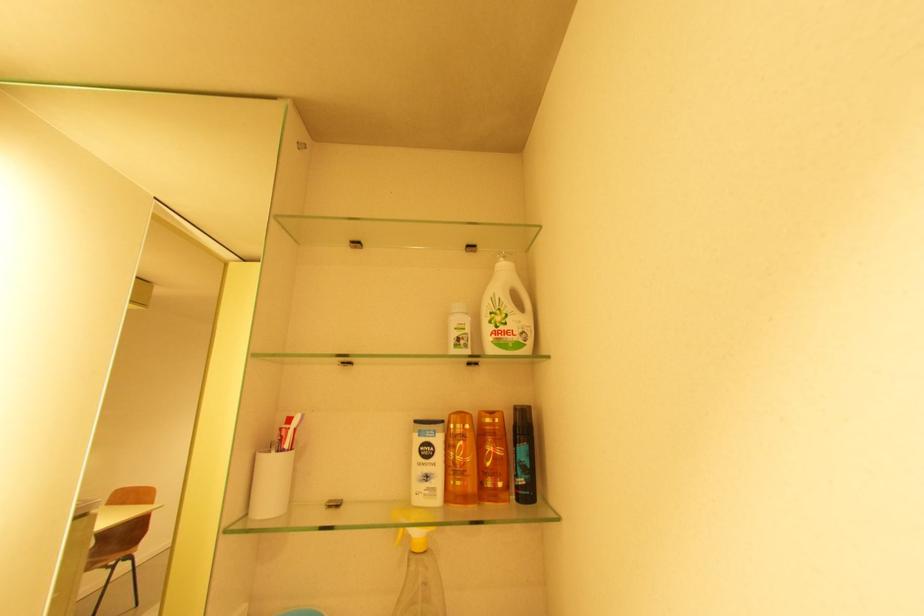
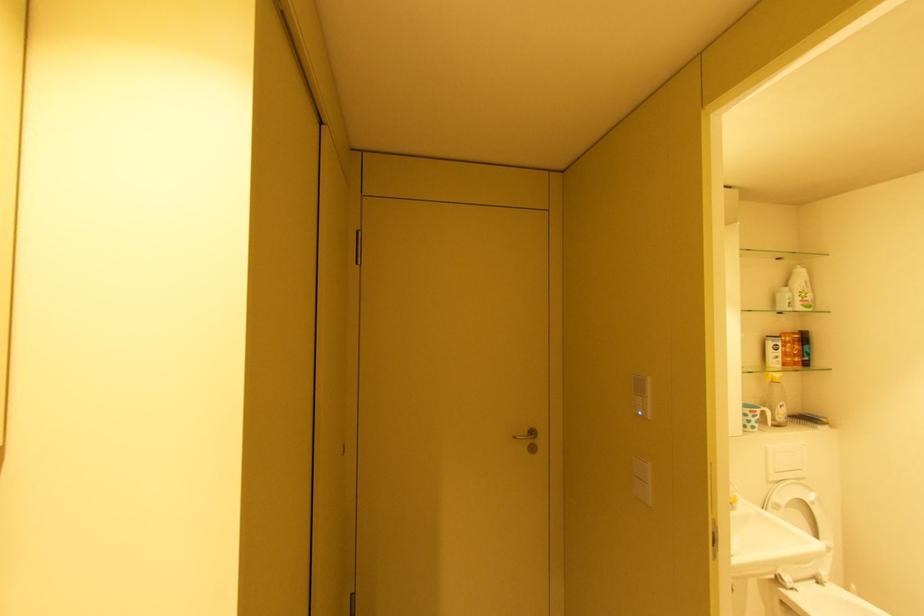
From the picture: The images are taken continuously from a first-person perspective. In which direction are you moving?

The cameraman walked toward left, backward.